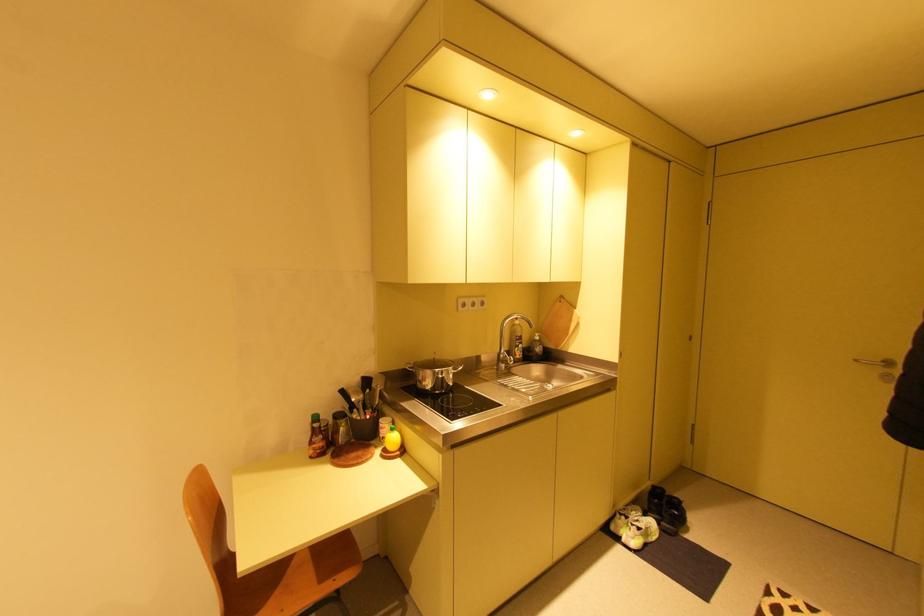
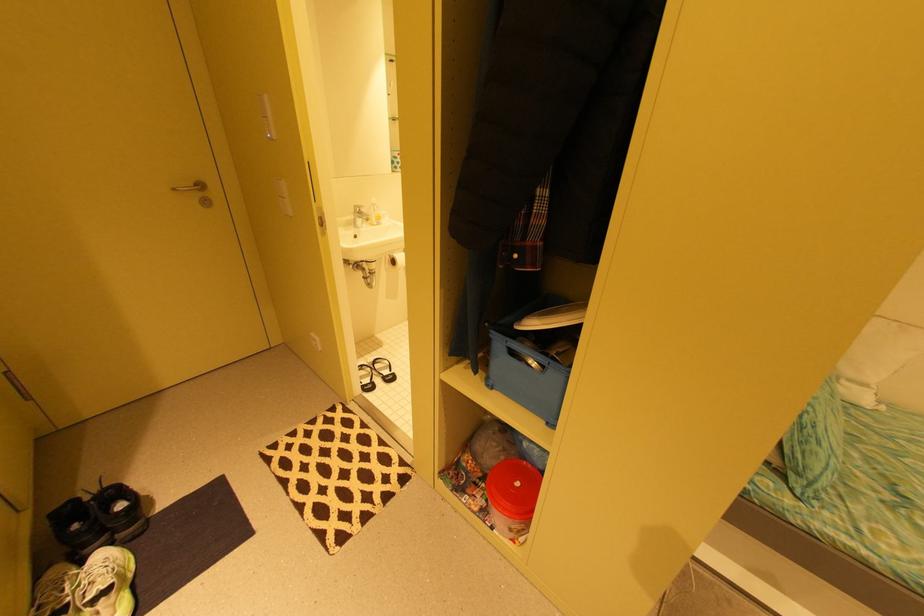
The point at (638, 503) is marked in the first image. Where is the corresponding point in the second image?

(44, 578)